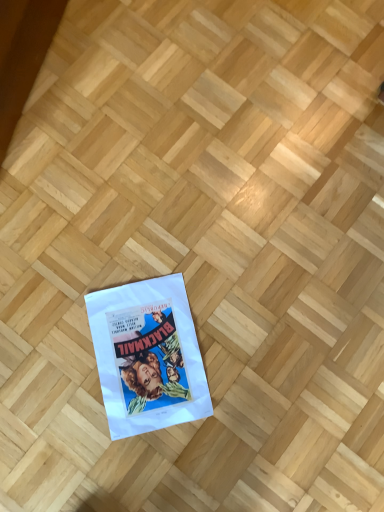
This screenshot has width=384, height=512. What do you see at coordinates (147, 356) in the screenshot?
I see `white paper at center` at bounding box center [147, 356].

What are the coordinates of `white paper at center` in the screenshot? It's located at (147, 356).

Identify the location of white paper at center. This screenshot has height=512, width=384. (147, 356).